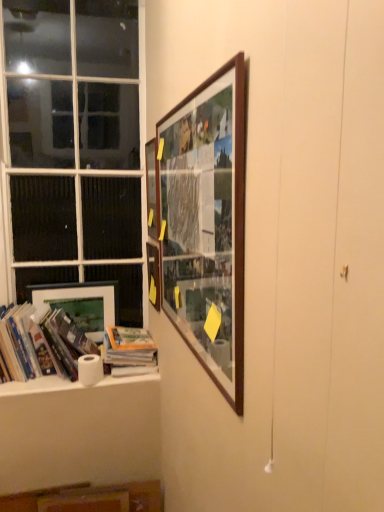
Identify the location of blank area to the left of white matte toilet paper at lower left. (61, 379).